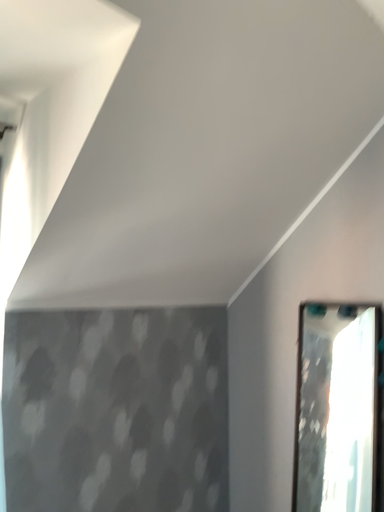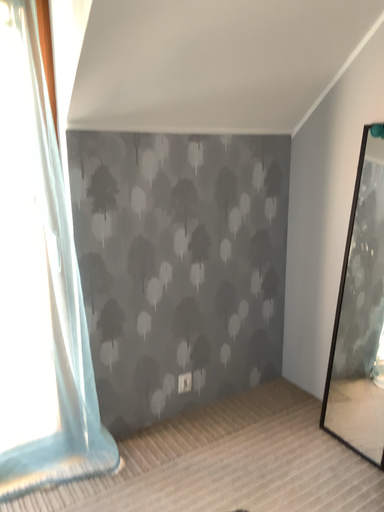
Question: Which way did the camera rotate in the video?

Choices:
 (A) rotated left
 (B) rotated right

Answer: (A)